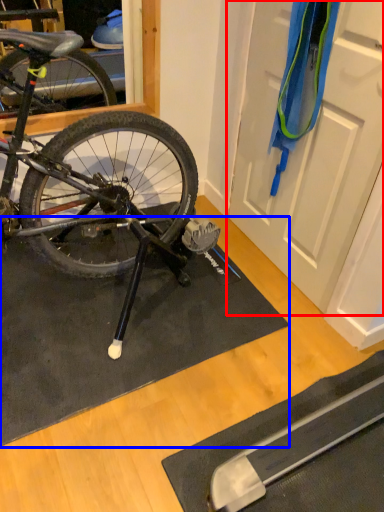
Question: Which of the following is the closest to the observer, door (highlighted by a red box) or doormat (highlighted by a blue box)?

Choices:
 (A) door
 (B) doormat

Answer: (A)